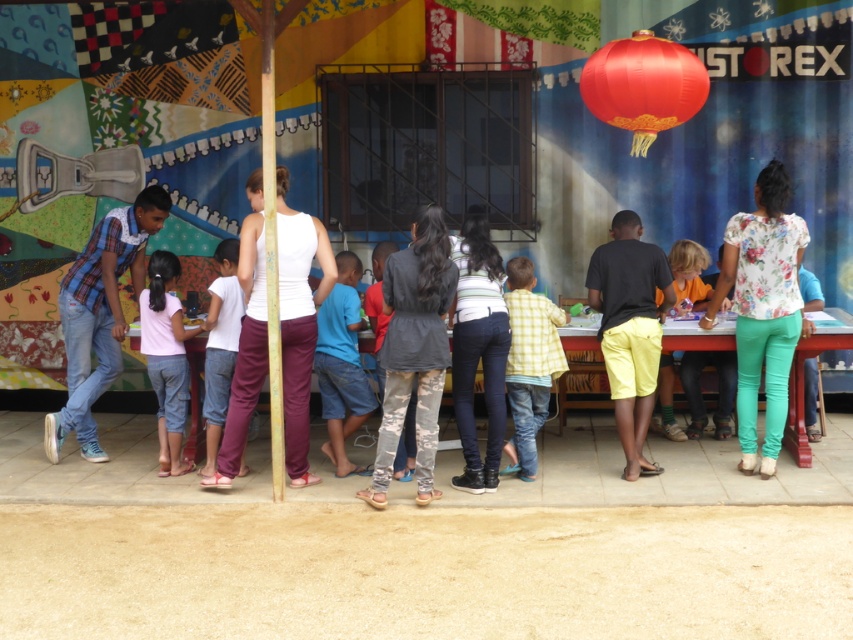
You are standing at the camera position and want to reach the point marked as point (706, 84). If you can walk 1 meter per second, how long will it take you to reach that point?

The distance between the camera and point (706, 84) is 7.33 meters. At a walking speed of 1 meter per second, it would take approximately 7.33 seconds to reach the point.